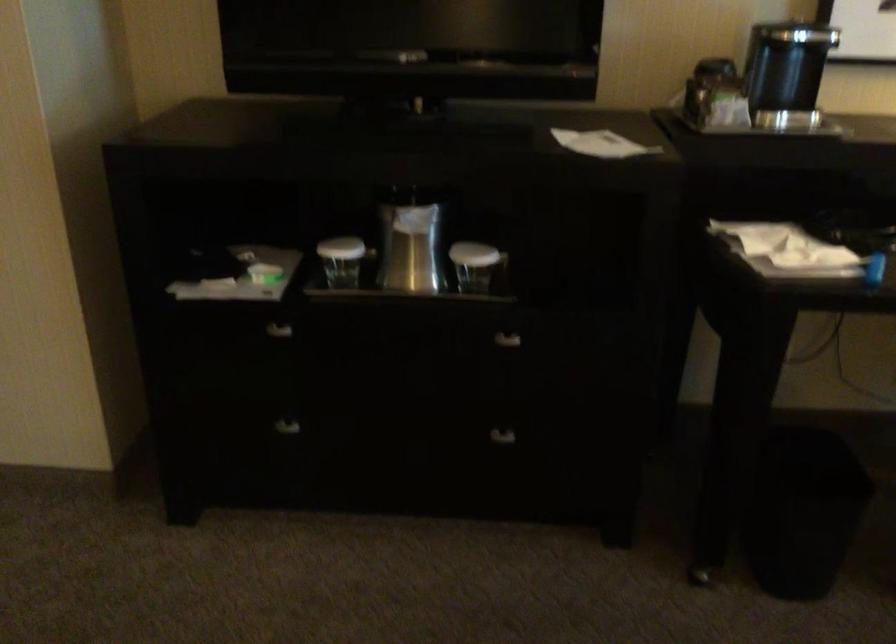
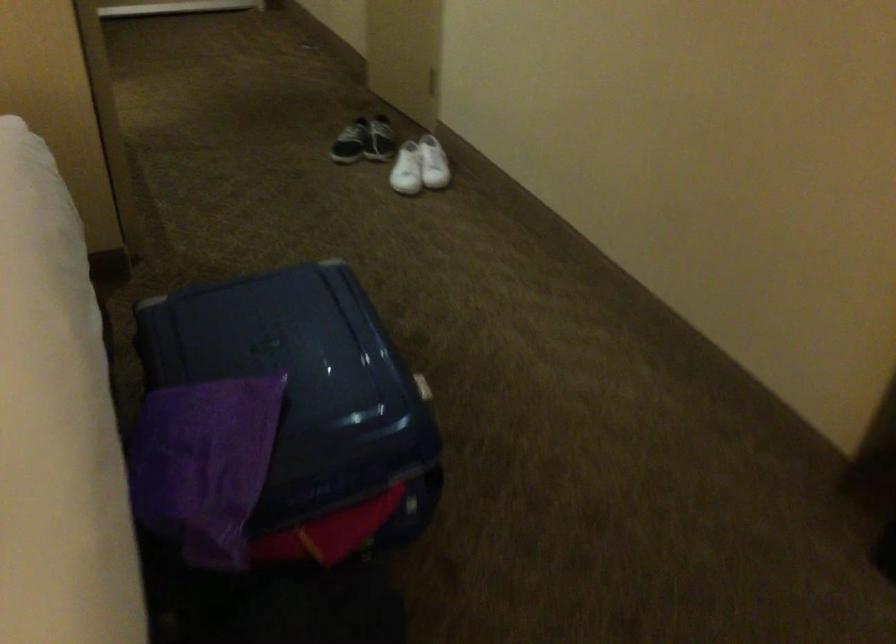
The first image is from the beginning of the video and the second image is from the end. How did the camera likely rotate when shooting the video?

The camera's rotation is toward left-down.